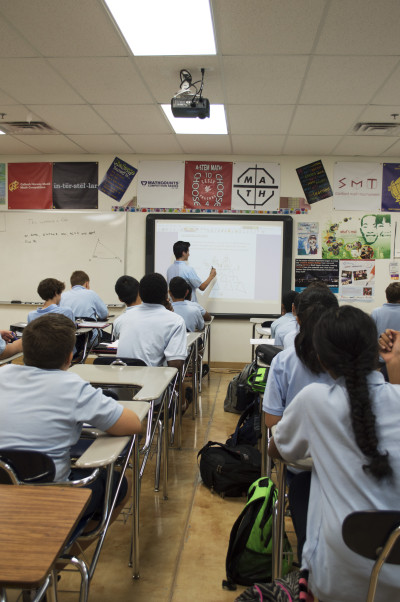
At what (x,y) coordinates should I click in order to perform the action: click on whiteboards. Please return your answer as a coordinate pair (x, y). The width and height of the screenshot is (400, 602). Looking at the image, I should click on (226, 250), (67, 250).